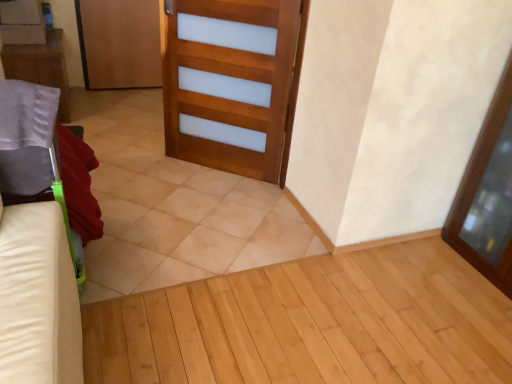
At what (x,y) coordinates should I click in order to perform the action: click on vacant space in wooden door at upper left, the first door from the left (from a real-world perspective). Please return your answer as a coordinate pair (x, y). The height and width of the screenshot is (384, 512). Looking at the image, I should click on (116, 89).